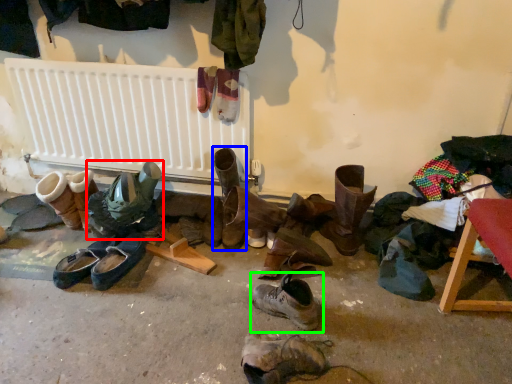
Question: Based on their relative distances, which object is farther from footwear (highlighted by a red box)? Choose from footwear (highlighted by a blue box) and footwear (highlighted by a green box).

Choices:
 (A) footwear
 (B) footwear

Answer: (B)